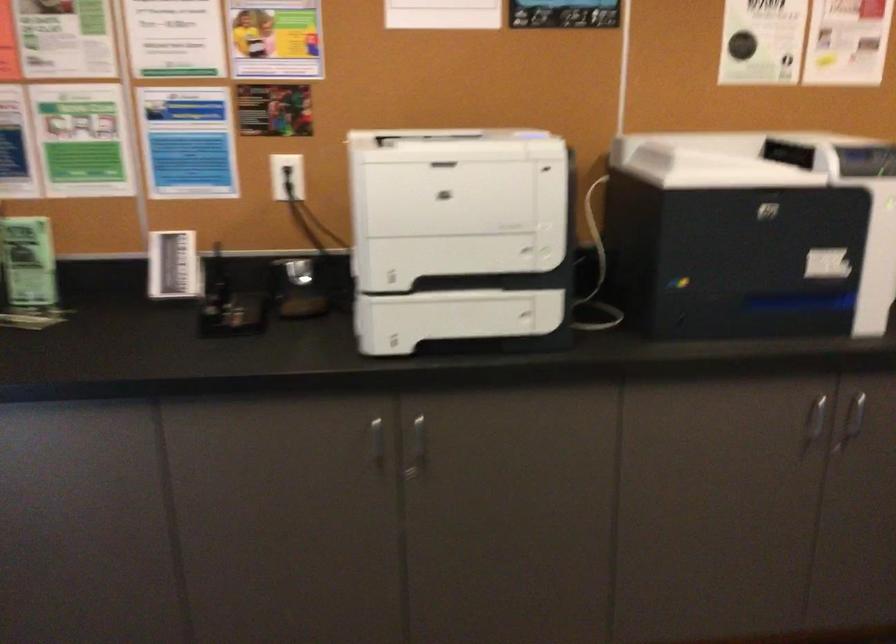
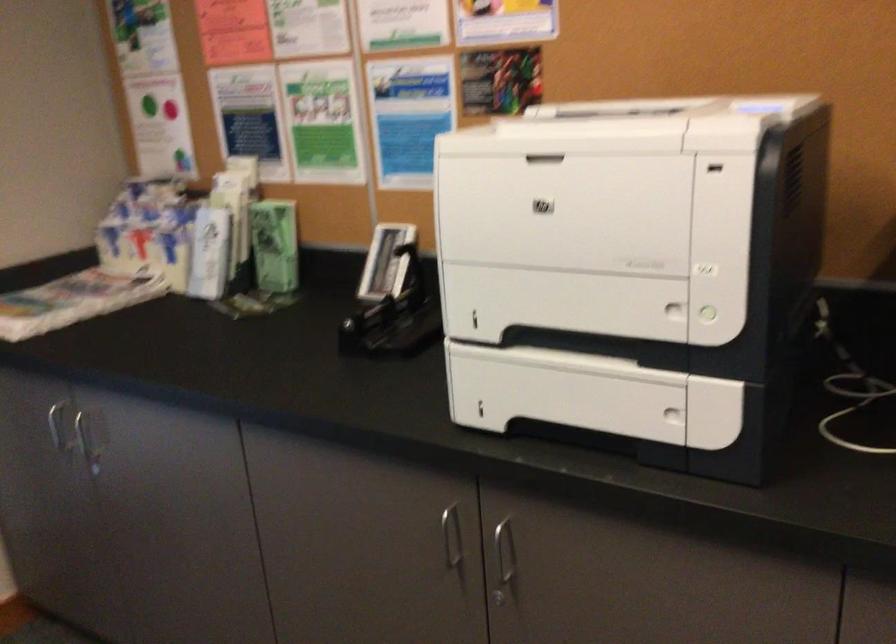
The point at (x=412, y=442) is marked in the first image. Where is the corresponding point in the second image?

(504, 559)